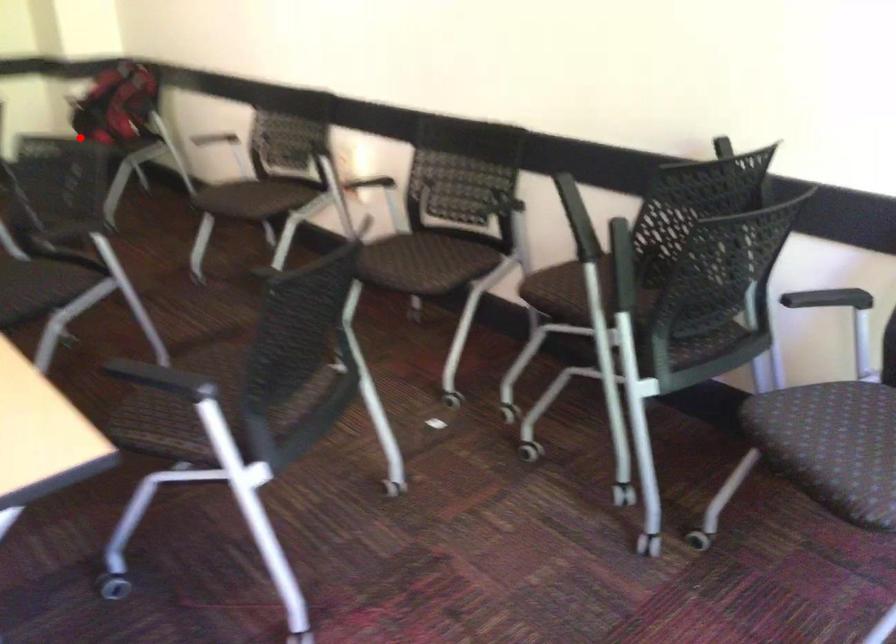
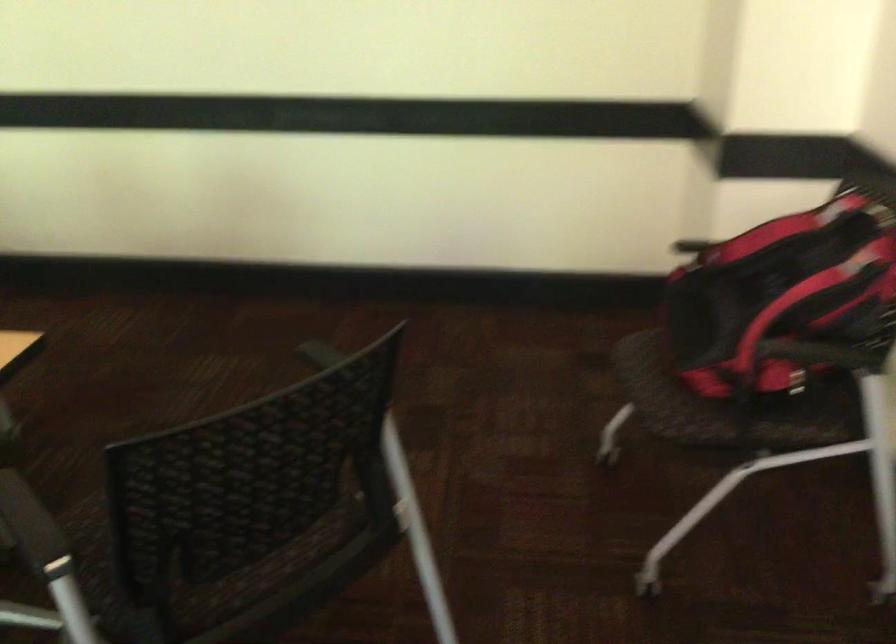
In the second image, find the point that corresponds to the highlighted location in the first image.

(647, 395)